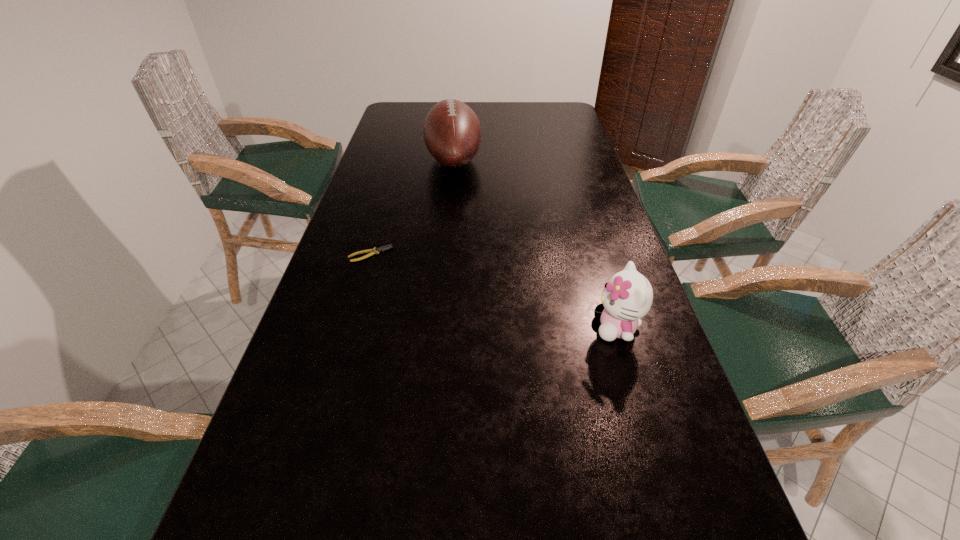
Locate an element on the screen. The width and height of the screenshot is (960, 540). vacant space located 0.160m on the right of the pliers is located at coordinates (455, 254).

Find the location of a particular element. Image resolution: width=960 pixels, height=540 pixels. object situated at the left edge is located at coordinates (375, 250).

This screenshot has width=960, height=540. Identify the location of object that is at the right edge. (627, 297).

In the image, there is a desktop. Where is `vacant space at the far edge`? vacant space at the far edge is located at coordinates (479, 113).

In the image, there is a desktop. At what (x,y) coordinates should I click in order to perform the action: click on vacant space at the left edge. Please return your answer as a coordinate pair (x, y). This screenshot has height=540, width=960. Looking at the image, I should click on (304, 325).

At what (x,y) coordinates should I click in order to perform the action: click on vacant space at the right edge of the desktop. Please return your answer as a coordinate pair (x, y). Looking at the image, I should click on (664, 354).

The height and width of the screenshot is (540, 960). I want to click on free space at the far left corner of the desktop, so click(412, 121).

In the image, there is a desktop. What are the coordinates of `free region at the far right corner` in the screenshot? It's located at (537, 103).

Identify the location of unoccupied area between the farthest object and the rightmost object. (535, 244).

Locate an element on the screen. This screenshot has width=960, height=540. free space between the second object from left to right and the second tallest object is located at coordinates (535, 244).